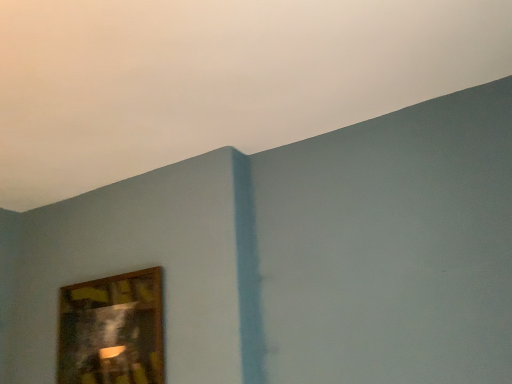
Describe the element at coordinates (112, 330) in the screenshot. I see `wooden frame at lower left` at that location.

Find the location of a particular element. wooden frame at lower left is located at coordinates pos(112,330).

Where is `wooden frame at lower left`? The width and height of the screenshot is (512, 384). wooden frame at lower left is located at coordinates (112, 330).